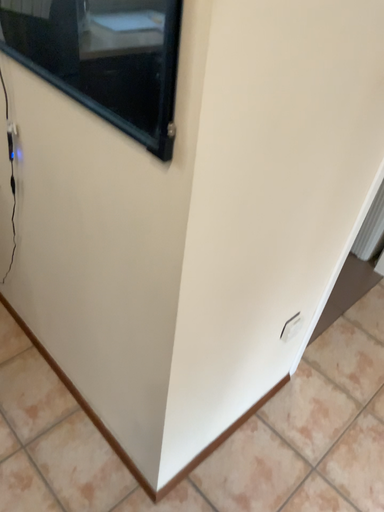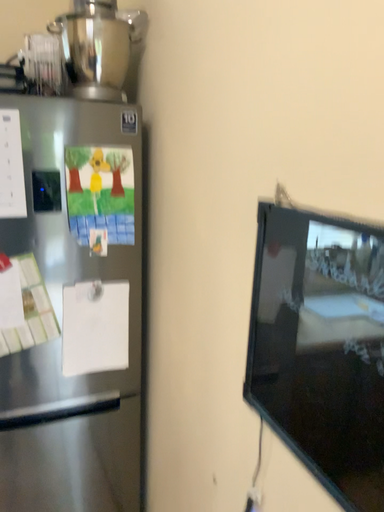
Question: How did the camera likely rotate when shooting the video?

Choices:
 (A) rotated left
 (B) rotated right

Answer: (A)